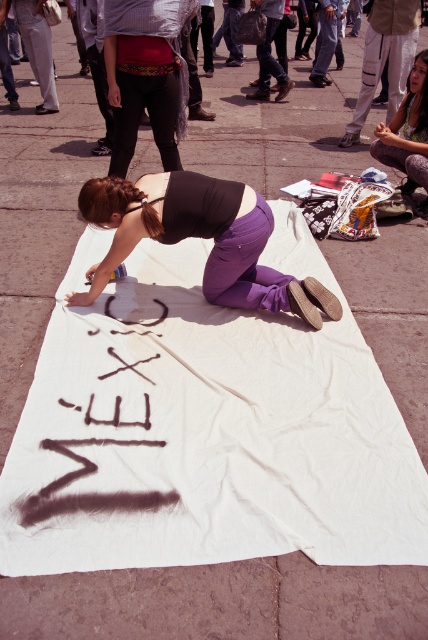
Question: Is matte red shirt at center further to camera compared to denim pants at lower right?

Choices:
 (A) no
 (B) yes

Answer: (A)

Question: Which object is closer to the camera taking this photo?

Choices:
 (A) spray paint sign at center
 (B) denim pants at lower right
 (C) purple cotton pants at center
 (D) white fabric at center

Answer: (D)

Question: Can you confirm if denim pants at lower right is positioned to the right of matte brown hair at lower right?

Choices:
 (A) no
 (B) yes

Answer: (B)

Question: Does white fabric at center have a smaller size compared to matte brown hair at lower right?

Choices:
 (A) no
 (B) yes

Answer: (A)

Question: Which point is closer to the camera?

Choices:
 (A) spray paint sign at center
 (B) matte red shirt at center
 (C) white fabric at center

Answer: (C)

Question: Estimate the real-world distances between objects in this image. Which object is closer to the denim pants at lower right?

Choices:
 (A) purple cotton pants at center
 (B) spray paint sign at center
 (C) white fabric at center

Answer: (C)